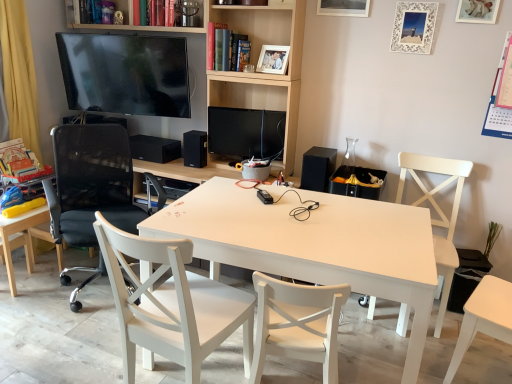
Question: In terms of height, does white matte table at center look taller or shorter compared to white lace picture frame at upper right, placed as the third picture frame when sorted from left to right?

Choices:
 (A) tall
 (B) short

Answer: (A)

Question: Is white matte table at center in front of or behind white lace picture frame at upper right, marked as the second picture frame in a right-to-left arrangement, in the image?

Choices:
 (A) behind
 (B) front

Answer: (B)

Question: Estimate the real-world distances between objects in this image. Which object is farther from the matte black tv at upper left?

Choices:
 (A) white wood chair at right, marked as the first chair in a right-to-left arrangement
 (B) black mesh office chair at left, which is the 2th chair from left to right
 (C) hardcover book at upper center, which is the 1th book in top-to-bottom order
 (D) black matte speaker at center, which is the 2th speaker from back to front
 (E) matte white picture frame at upper right, placed as the first picture frame when sorted from right to left

Answer: (E)

Question: Considering the real-world distances, which object is closest to the black mesh office chair at left?

Choices:
 (A) wooden photo frame at upper center, the 4th picture frame positioned from the right
 (B) black matte speaker at center, which is counted as the 3th speaker, starting from the right
 (C) white wood chair at center, the 3th chair viewed from the left
 (D) matte white picture frame at upper right, which is the fourth picture frame from left to right
 (E) white matte chair at center, arranged as the fourth chair when viewed from the left

Answer: (B)